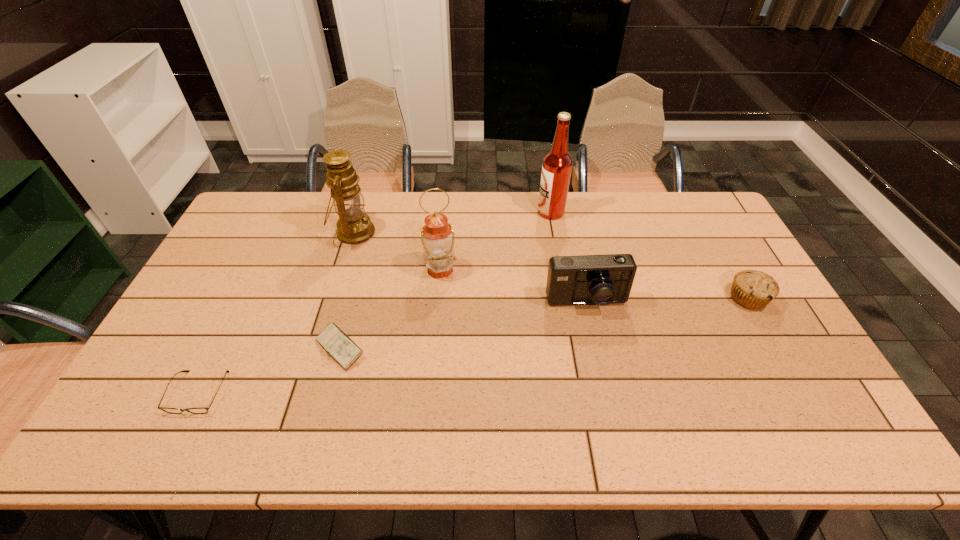
Locate an element on the screen. This screenshot has width=960, height=540. alcohol is located at coordinates (557, 165).

At what (x,y) coordinates should I click in order to perform the action: click on the farther oil lamp. Please return your answer as a coordinate pair (x, y). Looking at the image, I should click on (354, 227).

The height and width of the screenshot is (540, 960). What are the coordinates of `the fourth object from left to right` in the screenshot? It's located at (437, 236).

Find the location of `the third farthest object`. the third farthest object is located at coordinates (437, 236).

The width and height of the screenshot is (960, 540). Find the location of `camera`. camera is located at coordinates (587, 279).

Find the location of `muffin`. muffin is located at coordinates (752, 289).

The image size is (960, 540). In order to click on the third shortest object in this screenshot , I will do `click(752, 289)`.

Where is `diary`? Image resolution: width=960 pixels, height=540 pixels. diary is located at coordinates (344, 350).

You are a GUI agent. You are given a task and a screenshot of the screen. Output one action in this format:
    pyautogui.click(x=<x>, y=<y>)
    Task: Click on the shortest object
    The height and width of the screenshot is (540, 960).
    Given the screenshot: What is the action you would take?
    pyautogui.click(x=202, y=410)

The width and height of the screenshot is (960, 540). In order to click on spectacles in this screenshot , I will do `click(202, 410)`.